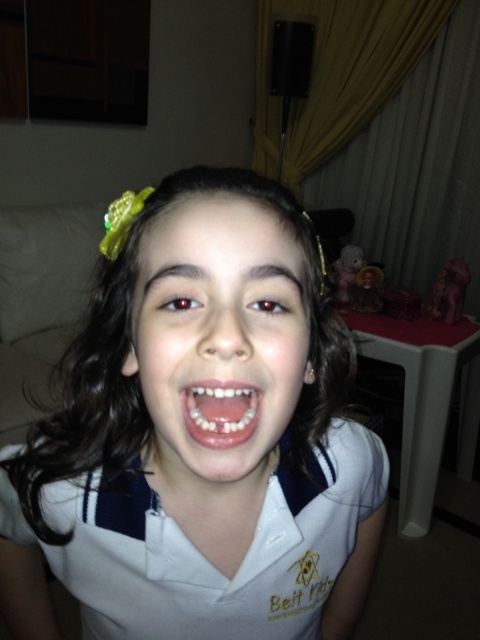
Can you confirm if white glossy shirt at center is taller than white matte school uniform at center?

Correct, white glossy shirt at center is much taller as white matte school uniform at center.

Based on the photo, who is more forward, (144, 385) or (111, 477)?

Point (144, 385) is in front.

Image resolution: width=480 pixels, height=640 pixels. In order to click on white glossy shirt at center in this screenshot , I will do `click(194, 440)`.

Is point (279, 364) positioned in front of point (235, 442)?

No, it is behind (235, 442).

Locate an element on the screen. The image size is (480, 640). smooth skin face at center is located at coordinates (217, 340).

Is point (180, 248) behind point (224, 408)?

That is True.

Find the location of a particular element. This screenshot has height=640, width=480. smooth skin face at center is located at coordinates (217, 340).

Who is positioned more to the left, white glossy shirt at center or white glossy teeth at center?

From the viewer's perspective, white glossy shirt at center appears more on the left side.

Find the location of a particular element. The image size is (480, 640). white glossy shirt at center is located at coordinates (194, 440).

The height and width of the screenshot is (640, 480). Find the location of `white glossy shirt at center`. white glossy shirt at center is located at coordinates (194, 440).